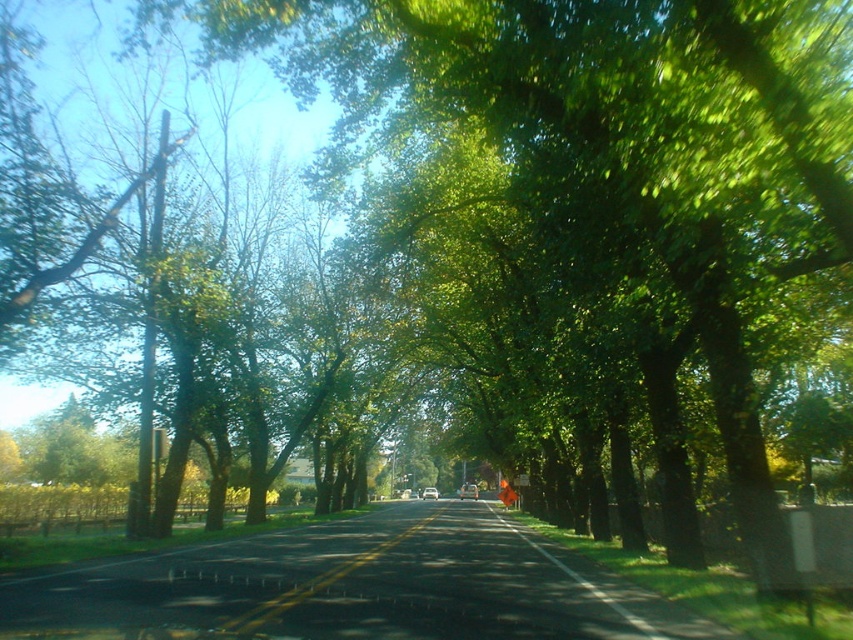
Question: From the image, what is the correct spatial relationship of green leafy tree at center in relation to metallic silver sedan at center?

Choices:
 (A) above
 (B) below

Answer: (A)

Question: Considering the real-world distances, which object is farthest from the yellow asphalt road at center?

Choices:
 (A) green leafy tree at center
 (B) metallic silver sedan at center

Answer: (B)

Question: Does yellow asphalt road at center have a greater width compared to metallic silver sedan at center?

Choices:
 (A) no
 (B) yes

Answer: (A)

Question: Among these objects, which one is farthest from the camera?

Choices:
 (A) yellow asphalt road at center
 (B) green leafy tree at center

Answer: (B)

Question: Which point is closer to the camera?

Choices:
 (A) yellow asphalt road at center
 (B) metallic silver sedan at center

Answer: (A)

Question: Does green leafy tree at center appear under metallic silver sedan at center?

Choices:
 (A) yes
 (B) no

Answer: (B)